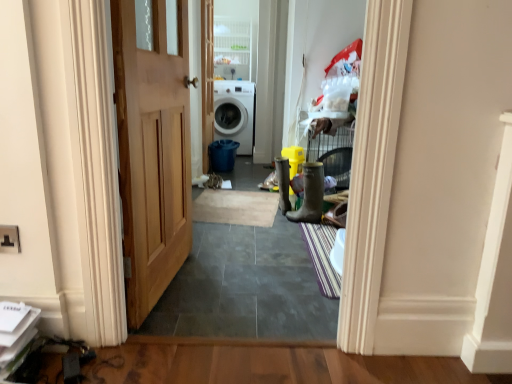
At what (x,y) coordinates should I click in order to perform the action: click on vacant area located to the right-hand side of wooden door at left. Please return your answer as a coordinate pair (x, y). The image size is (512, 384). Looking at the image, I should click on (241, 286).